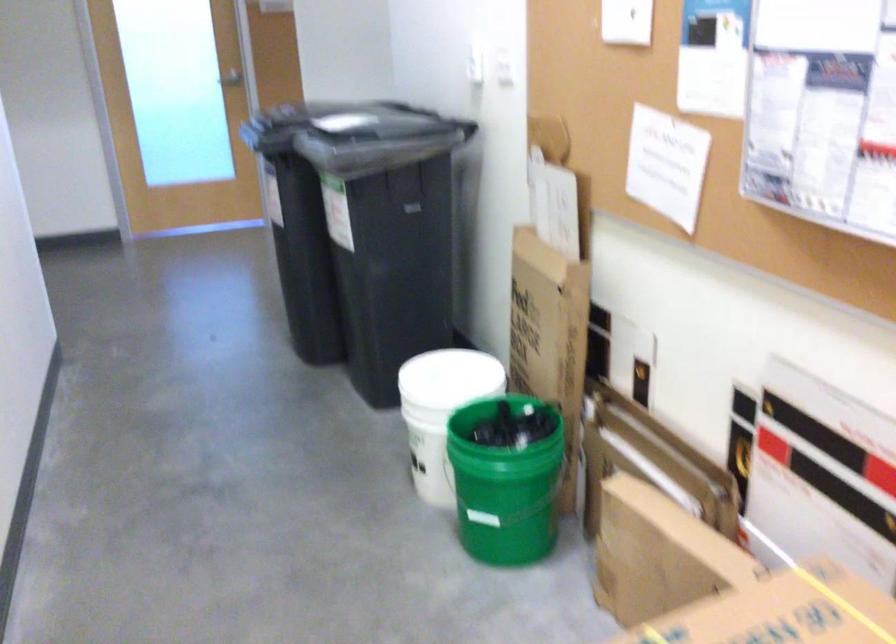
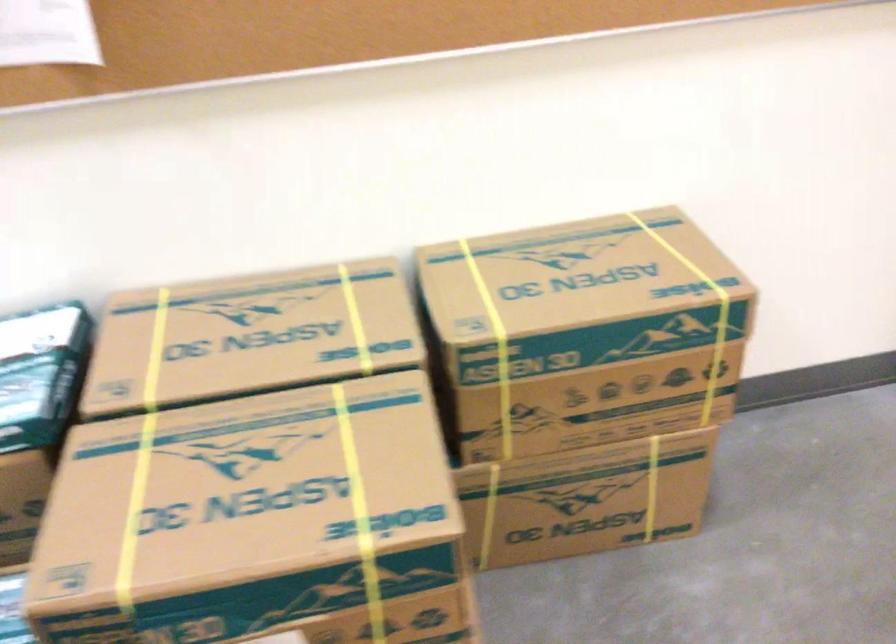
How did the camera likely rotate?

The camera's rotation is toward right-down.